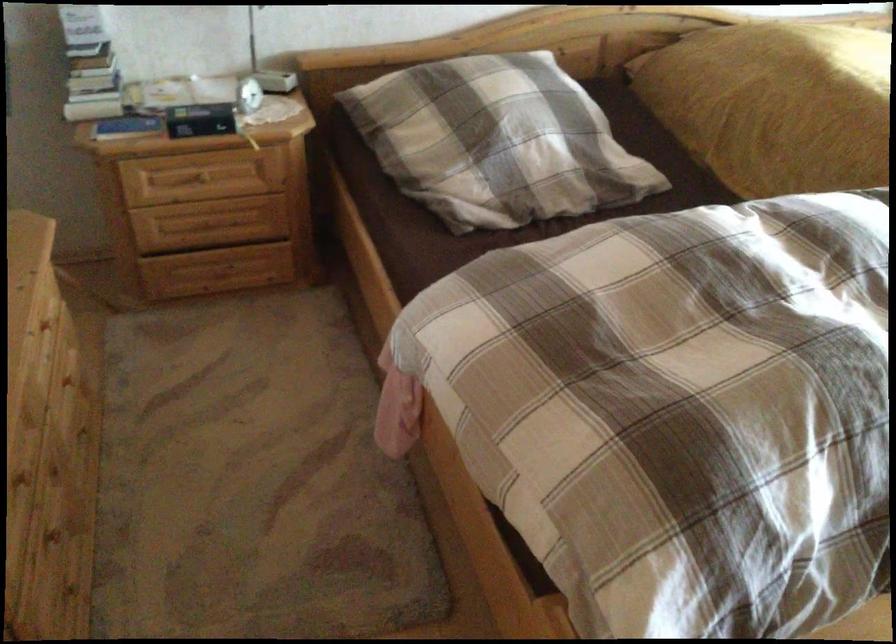
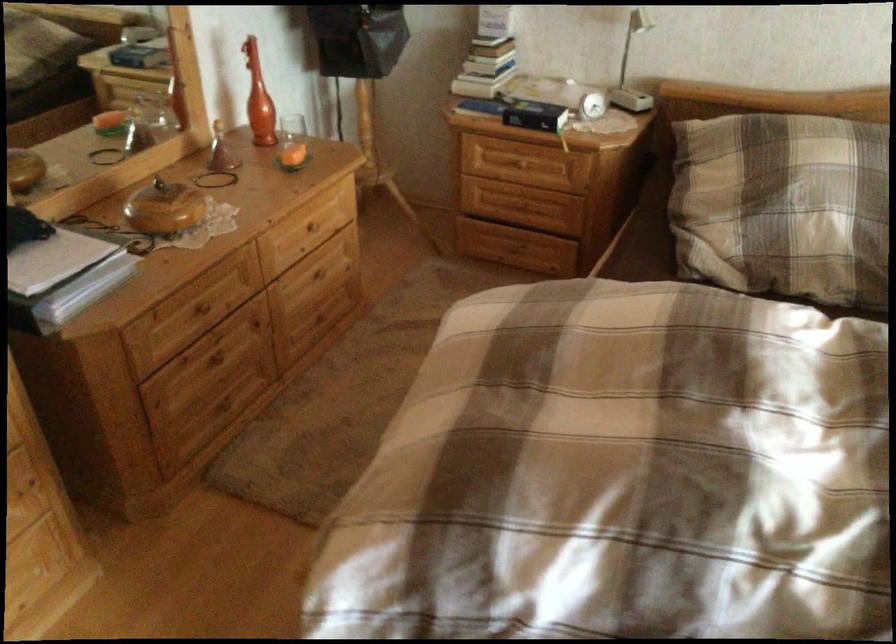
Locate, in the second image, the point that corresponds to (x=254, y=98) in the first image.

(587, 100)